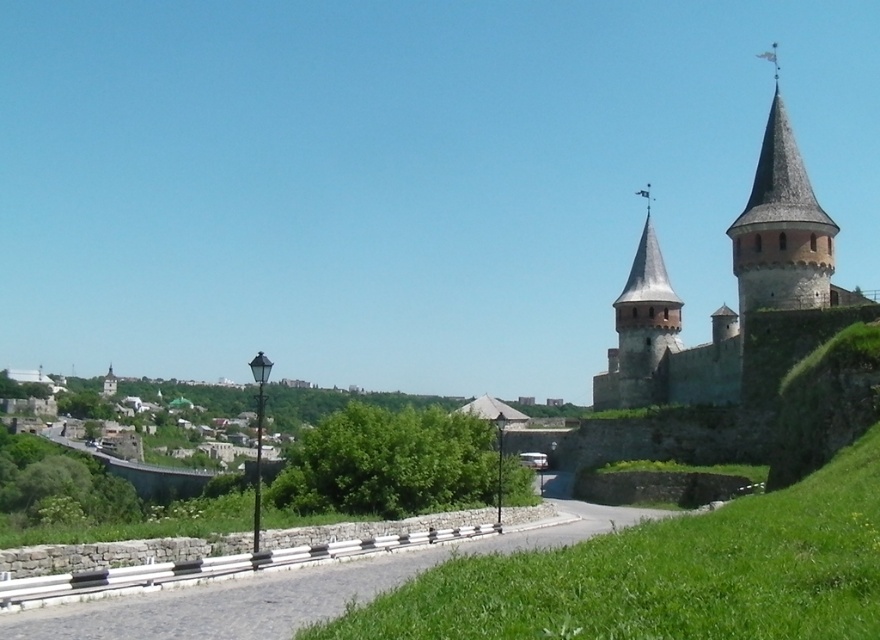
You are standing at the center of the cobblestone pathway in the foreground of the image. You want to take a photo of the stone gray castle at upper right. Which direction should you face to ensure the castle is in the frame?

Since the stone gray castle at upper right is positioned at point 0.447 on the x and 0.839 on the y, you should face towards the upper right direction to capture it in your photo.

You are standing at the base of the hill looking up at the stone gray castle at upper right and the gravel road at center. Which object appears taller from your perspective?

The stone gray castle at upper right appears taller than the gravel road at center from your perspective.